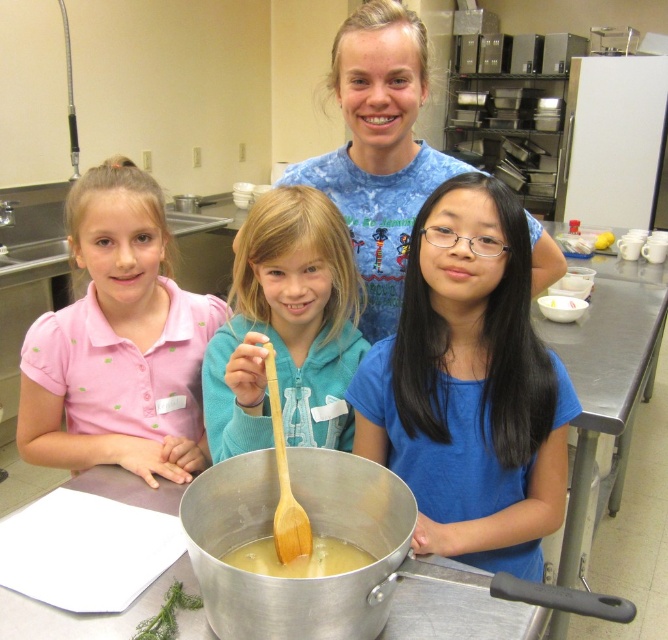
You are a photographer trying to capture a group photo of the blue matte shirt at center and the yellow matte cupcake at center. If you want to ensure both fit in the frame without cropping, which object should you focus on to adjust the camera angle?

The blue matte shirt at center is wider than the yellow matte cupcake at center, so you should focus on the blue matte shirt at center to adjust the camera angle to accommodate its larger width.

You are a chef observing the group around the pot. Which object is covering the other one, the pink cotton shirt at left or the wooden spoon at center?

The pink cotton shirt at left is positioned over the wooden spoon at center, so it is covering the wooden spoon at center.